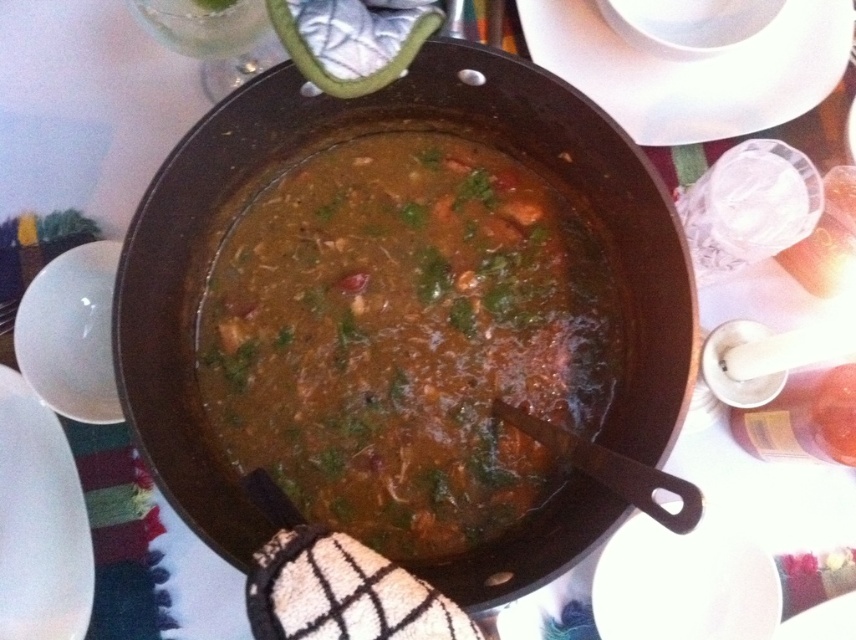
Question: Among these points, which one is farthest from the camera?

Choices:
 (A) (798, 49)
 (B) (711, 588)
 (C) (675, 301)

Answer: (A)

Question: Where is white matte plate at lower left located in relation to white glossy plate at lower right in the image?

Choices:
 (A) left
 (B) right

Answer: (A)

Question: Is white glossy plate at upper center positioned at the back of white matte plate at lower left?

Choices:
 (A) no
 (B) yes

Answer: (B)

Question: Which point is farther from the camera taking this photo?

Choices:
 (A) (610, 595)
 (B) (193, 141)
 (C) (7, 627)
 (D) (830, 74)

Answer: (D)

Question: Is matte black frying pan at center in front of white glossy plate at lower right?

Choices:
 (A) yes
 (B) no

Answer: (A)

Question: Which point is closer to the camera taking this photo?

Choices:
 (A) (715, 84)
 (B) (652, 609)

Answer: (B)